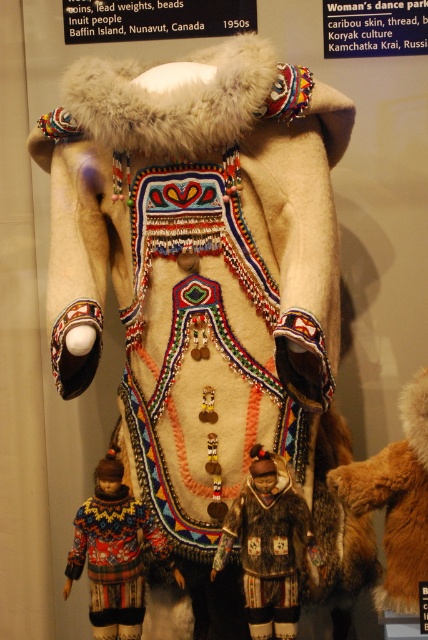
You are a museum curator planning to display both the knitted wool sweater at lower left and the brown fur coat at center in a new exhibition. Which item requires more space for proper display?

The knitted wool sweater at lower left requires more space for proper display because it is larger in size than the brown fur coat at center.

You are a fashion designer observing the traditional Inuit woman dance parka display. You notice the knitted wool sweater at lower left and the brown fur coat at center. Which of these two items is taller?

The knitted wool sweater at lower left has a greater height compared to the brown fur coat at center, so the knitted wool sweater at lower left is taller.